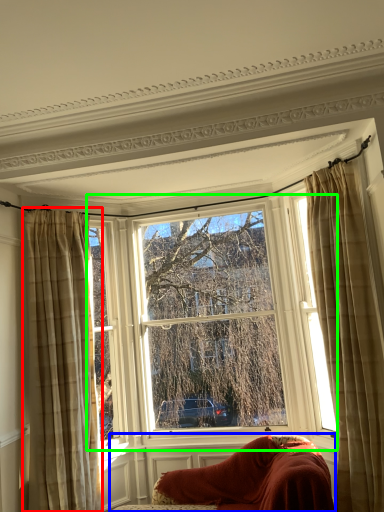
Question: Based on their relative distances, which object is nearer to curtain (highlighted by a red box)? Choose from furniture (highlighted by a blue box) and window (highlighted by a green box).

Choices:
 (A) furniture
 (B) window

Answer: (B)